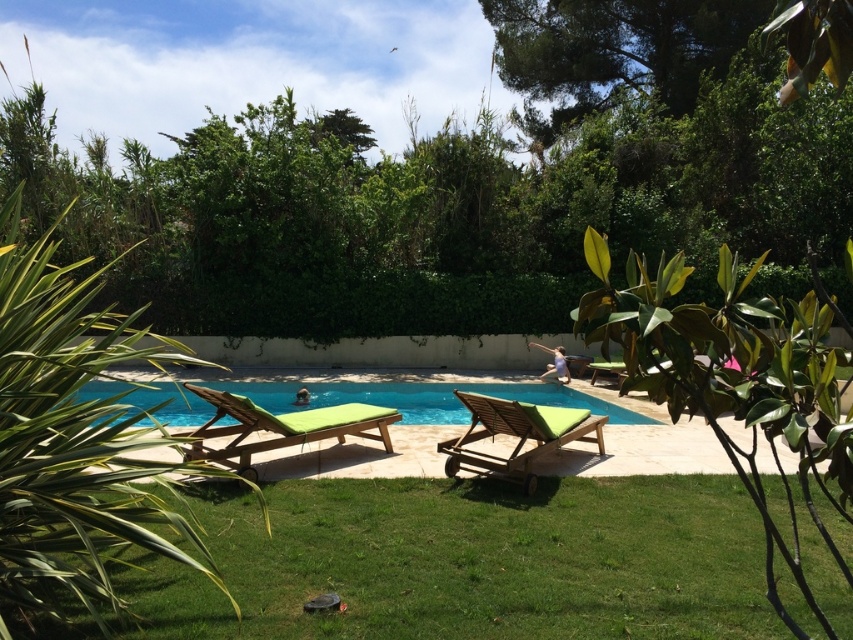
Is green leafy tree at upper center taller than green fabric lounge chair at lower center?

Yes.

Between green leafy tree at upper center and green fabric lounge chair at lower center, which one has more height?

green leafy tree at upper center

What do you see at coordinates (460, 188) in the screenshot? This screenshot has width=853, height=640. I see `green leafy tree at upper center` at bounding box center [460, 188].

Locate an element on the screen. green leafy tree at upper center is located at coordinates point(460,188).

Who is higher up, green leafy tree at upper center or wooden lounge chair with green cushion at center?

green leafy tree at upper center is above.

Is green leafy tree at upper center shorter than wooden lounge chair with green cushion at center?

Incorrect, green leafy tree at upper center's height does not fall short of wooden lounge chair with green cushion at center's.

Is point (573, 284) closer to camera compared to point (482, 413)?

No, it is behind (482, 413).

This screenshot has width=853, height=640. In order to click on green leafy tree at upper center in this screenshot , I will do `click(460, 188)`.

Between blue glassy swimming pool at center and wooden lounge chair with green cushion at center, which one has less height?

With less height is wooden lounge chair with green cushion at center.

Does blue glassy swimming pool at center lie behind wooden lounge chair with green cushion at center?

That is True.

Describe the element at coordinates (421, 397) in the screenshot. I see `blue glassy swimming pool at center` at that location.

This screenshot has height=640, width=853. In order to click on blue glassy swimming pool at center in this screenshot , I will do `click(421, 397)`.